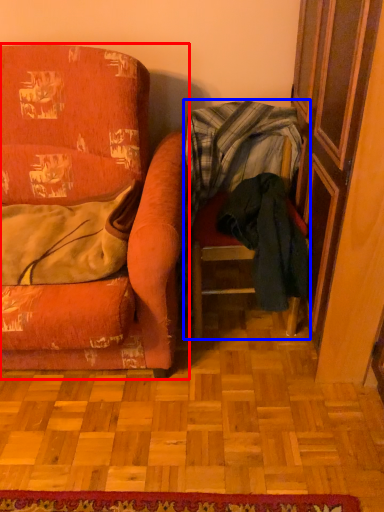
Question: Which of the following is the closest to the observer, chair (highlighted by a red box) or chair (highlighted by a blue box)?

Choices:
 (A) chair
 (B) chair

Answer: (A)